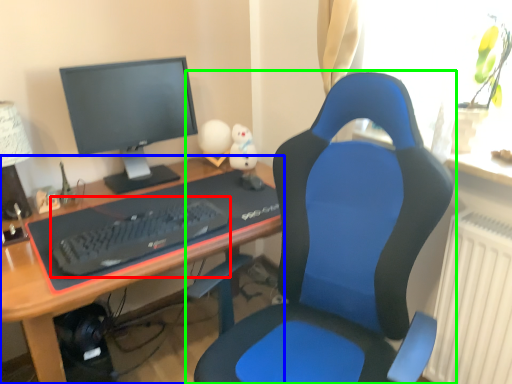
Question: Which object is the farthest from computer keyboard (highlighted by a red box)? Choose among these: desk (highlighted by a blue box) or chair (highlighted by a green box).

Choices:
 (A) desk
 (B) chair

Answer: (B)